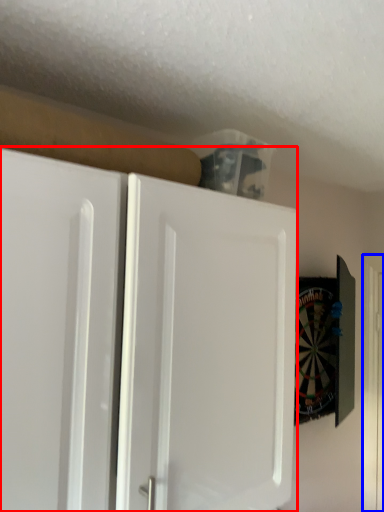
Question: Which object is further to the camera taking this photo, cabinetry (highlighted by a red box) or door (highlighted by a blue box)?

Choices:
 (A) cabinetry
 (B) door

Answer: (B)